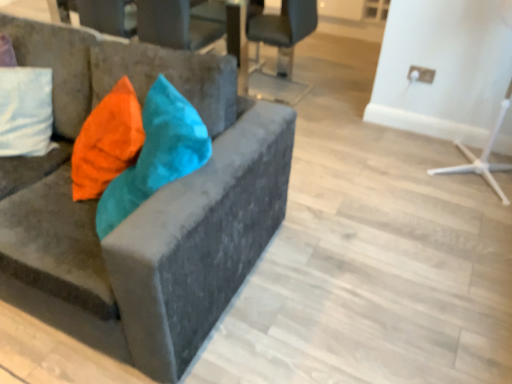
Question: Considering the relative positions of velvet cushion at upper left, positioned as the third chair in back-to-front order, and metallic gray chair at upper center, arranged as the second chair when viewed from the front, in the image provided, is velvet cushion at upper left, positioned as the third chair in back-to-front order, to the right of metallic gray chair at upper center, arranged as the second chair when viewed from the front, from the viewer's perspective?

Choices:
 (A) no
 (B) yes

Answer: (A)

Question: Is velvet cushion at upper left, placed as the 1th chair when sorted from front to back, positioned behind metallic gray chair at upper center, which is counted as the 2th chair, starting from the back?

Choices:
 (A) no
 (B) yes

Answer: (A)

Question: Can we say velvet cushion at upper left, positioned as the third chair in back-to-front order, lies outside metallic gray chair at upper center, which is counted as the 2th chair, starting from the back?

Choices:
 (A) yes
 (B) no

Answer: (A)

Question: Considering the relative sizes of velvet cushion at upper left, positioned as the third chair in back-to-front order, and metallic gray chair at upper center, which is counted as the 2th chair, starting from the back, in the image provided, is velvet cushion at upper left, positioned as the third chair in back-to-front order, wider than metallic gray chair at upper center, which is counted as the 2th chair, starting from the back,?

Choices:
 (A) yes
 (B) no

Answer: (A)

Question: Is metallic gray chair at upper center, arranged as the second chair when viewed from the front, a part of velvet cushion at upper left, positioned as the third chair in back-to-front order?

Choices:
 (A) no
 (B) yes

Answer: (A)

Question: Is velvet cushion at upper left, positioned as the third chair in back-to-front order, looking in the opposite direction of metallic gray chair at upper center, which is counted as the 2th chair, starting from the back?

Choices:
 (A) no
 (B) yes

Answer: (B)

Question: Can you confirm if velvet cushion at upper left, placed as the 1th chair when sorted from front to back, is wider than matte black chair at upper center, which is the third chair from front to back?

Choices:
 (A) no
 (B) yes

Answer: (B)

Question: Can you confirm if velvet cushion at upper left, placed as the 1th chair when sorted from front to back, is smaller than matte black chair at upper center, which is the third chair from front to back?

Choices:
 (A) no
 (B) yes

Answer: (A)

Question: Would you consider velvet cushion at upper left, positioned as the third chair in back-to-front order, to be distant from matte black chair at upper center, which ranks as the first chair in back-to-front order?

Choices:
 (A) yes
 (B) no

Answer: (A)

Question: From a real-world perspective, is velvet cushion at upper left, positioned as the third chair in back-to-front order, positioned over matte black chair at upper center, which is the third chair from front to back, based on gravity?

Choices:
 (A) yes
 (B) no

Answer: (A)

Question: Could matte black chair at upper center, which ranks as the first chair in back-to-front order, be considered to be inside velvet cushion at upper left, positioned as the third chair in back-to-front order?

Choices:
 (A) no
 (B) yes

Answer: (A)

Question: Is velvet cushion at upper left, positioned as the third chair in back-to-front order, facing away from matte black chair at upper center, which is the third chair from front to back?

Choices:
 (A) yes
 (B) no

Answer: (A)

Question: From a real-world perspective, is velvet orange pillow at left beneath matte black chair at upper center, which is the third chair from front to back?

Choices:
 (A) yes
 (B) no

Answer: (B)